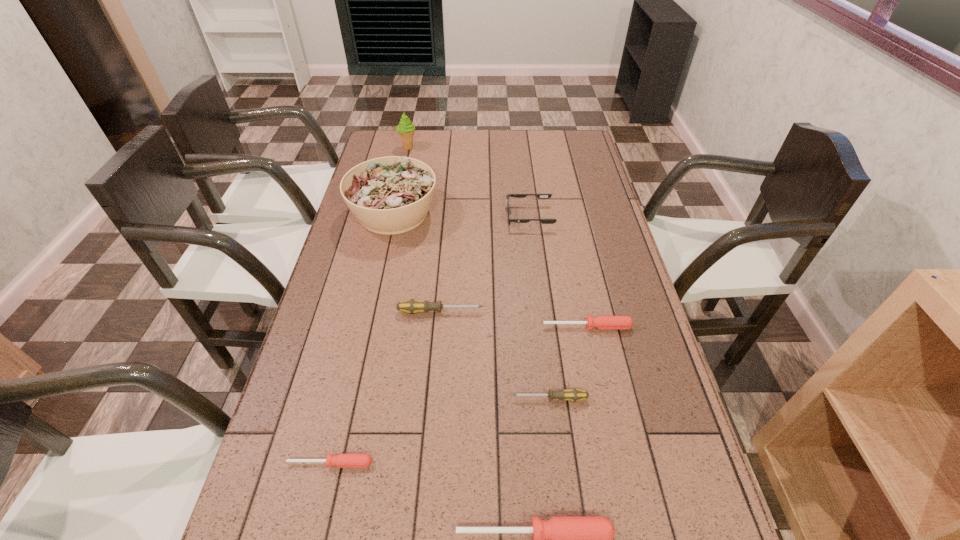
Image resolution: width=960 pixels, height=540 pixels. In order to click on free space at the left edge of the desktop in this screenshot , I will do `click(311, 512)`.

Locate an element on the screen. free space at the right edge is located at coordinates (660, 420).

This screenshot has height=540, width=960. Identify the location of free location at the far left corner. (393, 145).

Identify the location of free spot at the far right corner of the desktop. (579, 152).

Where is `empty space between the salad and the left gray screwdriver`? The width and height of the screenshot is (960, 540). empty space between the salad and the left gray screwdriver is located at coordinates (417, 262).

The height and width of the screenshot is (540, 960). I want to click on free space between the shortest screwdriver and the fifth farthest object, so click(x=459, y=395).

Identify the location of vacant space in between the nearer gray screwdriver and the green icecream. This screenshot has height=540, width=960. [479, 273].

Where is `vacant space that's between the smallest red screwdriver and the sunglasses`? vacant space that's between the smallest red screwdriver and the sunglasses is located at coordinates (430, 340).

Where is `vacant point located between the fourth farthest object and the salad`? This screenshot has height=540, width=960. vacant point located between the fourth farthest object and the salad is located at coordinates (417, 262).

Locate an element on the screen. The height and width of the screenshot is (540, 960). free space between the sunglasses and the second farthest screwdriver is located at coordinates (559, 272).